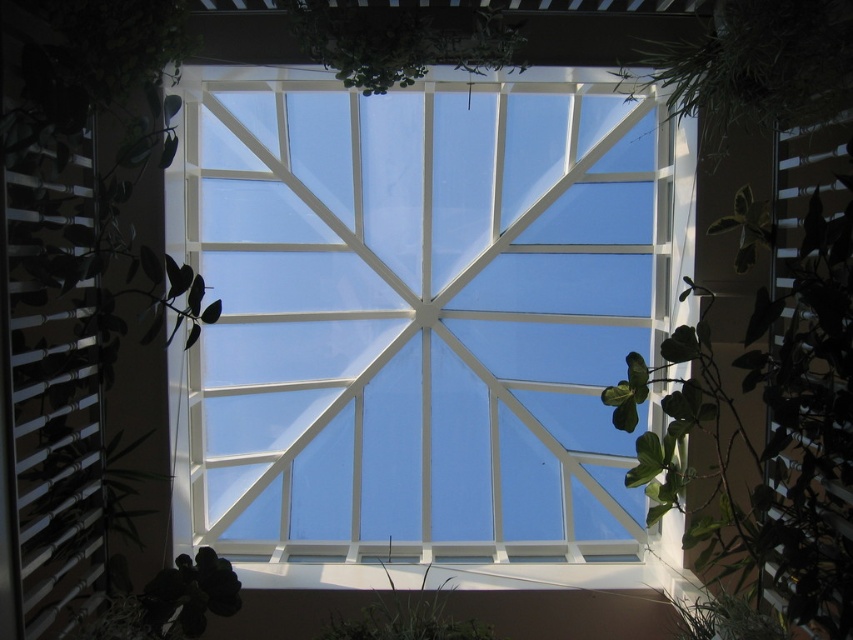
Question: Which is farther from the green leafy plant at center?

Choices:
 (A) green leafy plant at upper center
 (B) green matte leaf at lower left
 (C) green leafy plant at upper right
 (D) transparent glass window at center

Answer: (C)

Question: Does transparent glass window at center have a greater width compared to green leafy plant at center?

Choices:
 (A) yes
 (B) no

Answer: (B)

Question: In this image, where is green matte leaf at lower left located relative to green leafy plant at center?

Choices:
 (A) below
 (B) above

Answer: (B)

Question: Does green matte leaf at lower left have a lesser width compared to green leafy plant at center?

Choices:
 (A) no
 (B) yes

Answer: (B)

Question: Which object is the farthest from the green leafy plant at center?

Choices:
 (A) green leafy plant at upper center
 (B) green leafy plant at upper right
 (C) green matte leaf at lower left
 (D) transparent glass window at center

Answer: (B)

Question: Which point is farther from the camera taking this photo?

Choices:
 (A) (419, 35)
 (B) (839, 92)
 (C) (390, 550)
 (D) (248, 296)

Answer: (D)